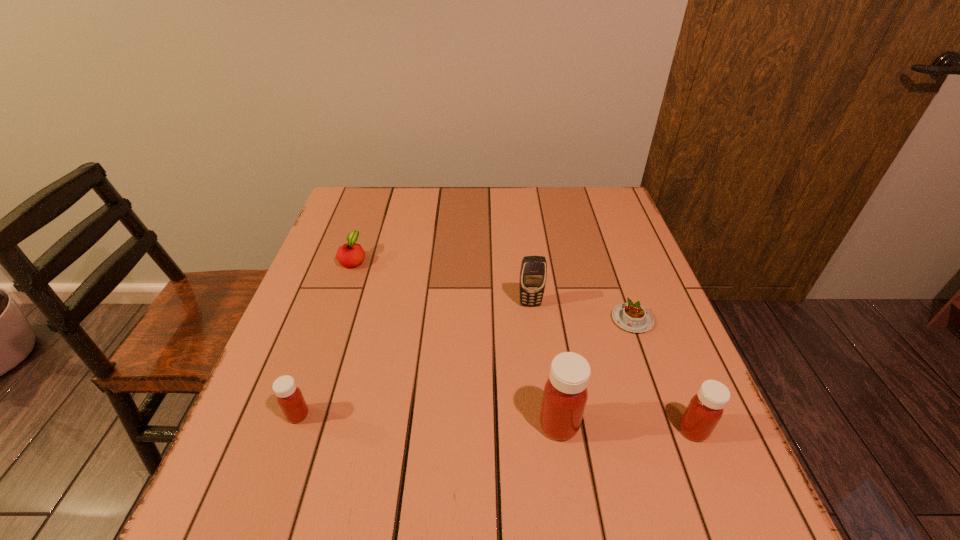
I want to click on the leftmost medicine, so click(289, 397).

This screenshot has width=960, height=540. I want to click on the shortest medicine, so click(x=289, y=397).

Identify the location of the tallest medicine. The width and height of the screenshot is (960, 540). click(565, 394).

The image size is (960, 540). Find the location of `the tallest object`. the tallest object is located at coordinates (565, 394).

At what (x,y) coordinates should I click in order to perform the action: click on the rightmost medicine. Please return your answer as a coordinate pair (x, y). Looking at the image, I should click on (705, 409).

The width and height of the screenshot is (960, 540). I want to click on the second shortest medicine, so click(x=705, y=409).

Where is `cellular telephone`? cellular telephone is located at coordinates (533, 273).

Find the location of `apple`. apple is located at coordinates (351, 254).

Image resolution: width=960 pixels, height=540 pixels. What are the coordinates of `the fifth tallest object` in the screenshot? It's located at (351, 254).

Locate an element on the screen. pudding is located at coordinates (632, 317).